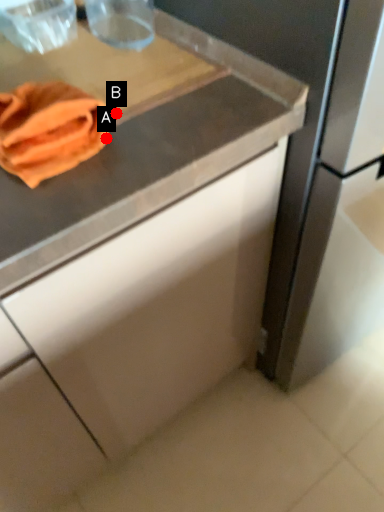
Question: Two points are circled on the image, labeled by A and B beside each circle. Which point appears closest to the camera in this image?

Choices:
 (A) A is closer
 (B) B is closer

Answer: (A)